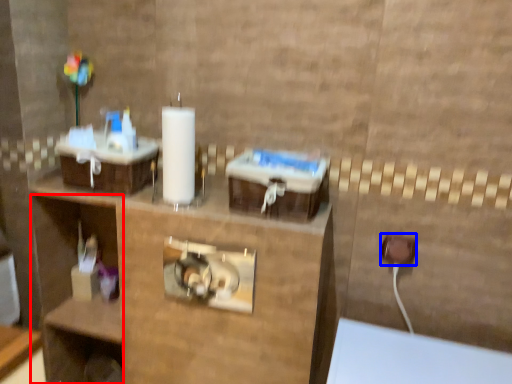
Question: Which of the following is the farthest to the observer, shelf (highlighted by a red box) or electric outlet (highlighted by a blue box)?

Choices:
 (A) shelf
 (B) electric outlet

Answer: (A)